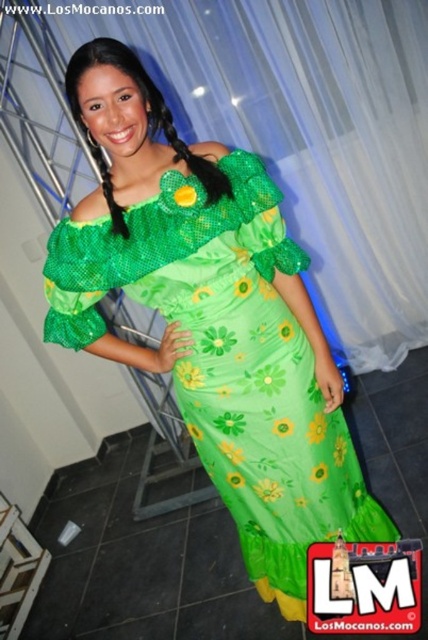
Can you confirm if translucent white curtain at upper center is positioned below green satin dress at center?

Incorrect, translucent white curtain at upper center is not positioned below green satin dress at center.

Between translucent white curtain at upper center and green satin dress at center, which one has less height?

Standing shorter between the two is green satin dress at center.

Who is more distant from viewer, (410,234) or (145,275)?

The point (410,234) is more distant.

You are a GUI agent. You are given a task and a screenshot of the screen. Output one action in this format:
    pyautogui.click(x=<x>, y=<y>)
    Task: Click on the translucent white curtain at upper center
    This screenshot has height=640, width=428.
    Given the screenshot: What is the action you would take?
    pyautogui.click(x=285, y=131)